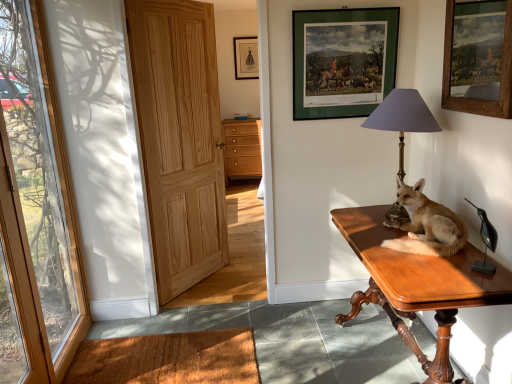
The width and height of the screenshot is (512, 384). I want to click on blank space above brown coir mat at lower left (from a real-world perspective), so click(166, 357).